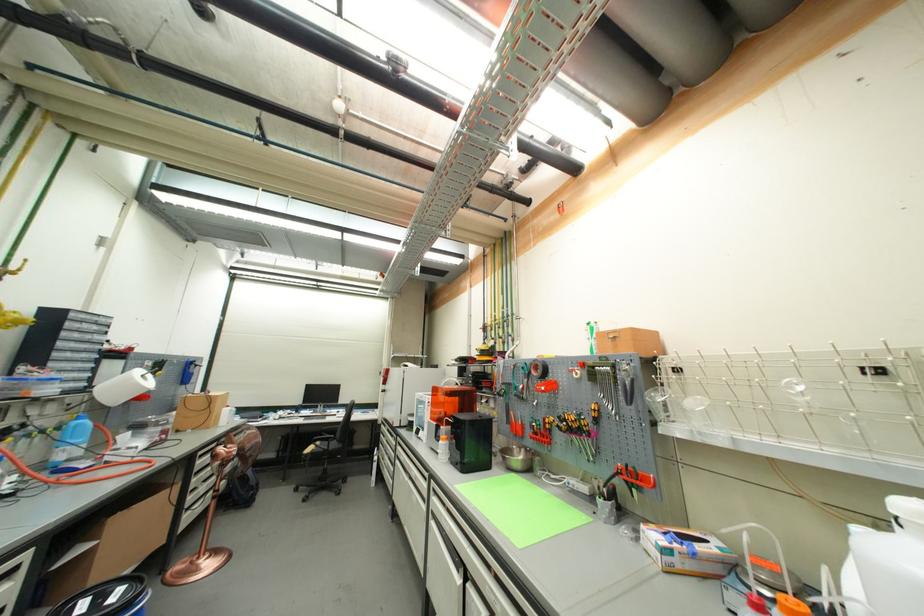
You are a GUI agent. You are given a task and a screenshot of the screen. Output one action in this format:
    pyautogui.click(x=<x>, y=<y>)
    Task: Click on the silver wrench
    This screenshot has height=616, width=924.
    Given the screenshot: What is the action you would take?
    pyautogui.click(x=610, y=422)